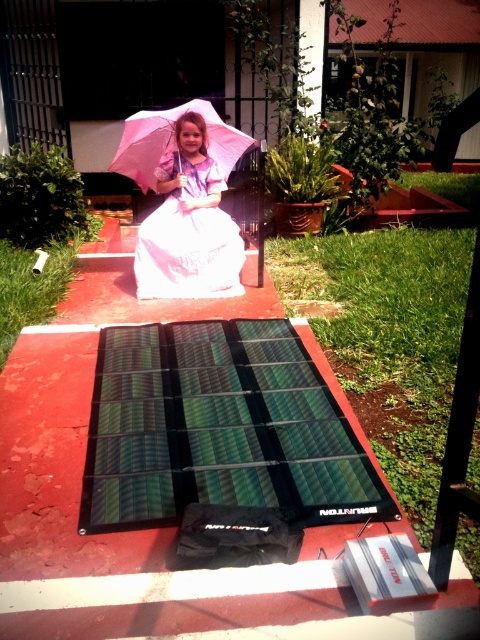
You are standing at the position of the girl and want to place an object in front of you. Which of the two points, point (213, 282) or point (237, 150), is closer to you?

Point (213, 282) is in front of point (237, 150), so it is closer to you.

You are standing in front of the scene and want to know how far the point at coordinates (337, 484) is from you. Can you determine the distance?

The distance of point (337, 484) from viewer is 7.31 feet.

You are a photographer setting up for a shoot. You see the green flexible solar panel at center and the purple satin dress at center in the scene. Which object is positioned lower in the image?

The green flexible solar panel at center is located below the purple satin dress at center, so it is positioned lower in the image.